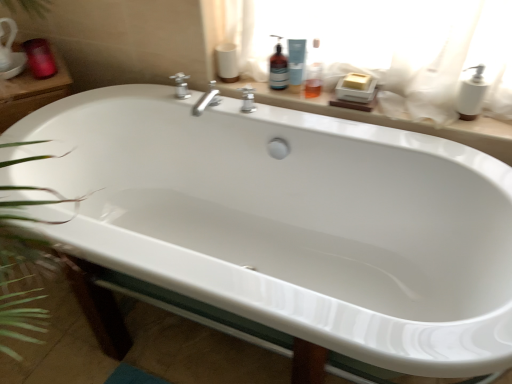
Question: Should I look upward or downward to see matte red candle at upper left?

Choices:
 (A) down
 (B) up

Answer: (B)

Question: Considering the relative sizes of matte beige soap dish at upper center and translucent plastic bottle at upper center, placed as the 2th cleaning product when sorted from right to left, in the image provided, is matte beige soap dish at upper center smaller than translucent plastic bottle at upper center, placed as the 2th cleaning product when sorted from right to left,?

Choices:
 (A) no
 (B) yes

Answer: (A)

Question: Considering the relative sizes of matte beige soap dish at upper center and translucent plastic bottle at upper center, acting as the 1th cleaning product starting from the left, in the image provided, is matte beige soap dish at upper center bigger than translucent plastic bottle at upper center, acting as the 1th cleaning product starting from the left,?

Choices:
 (A) no
 (B) yes

Answer: (B)

Question: Is the depth of matte beige soap dish at upper center less than that of translucent plastic bottle at upper center, acting as the 1th cleaning product starting from the left?

Choices:
 (A) yes
 (B) no

Answer: (A)

Question: Is matte beige soap dish at upper center turned away from translucent plastic bottle at upper center, acting as the 1th cleaning product starting from the left?

Choices:
 (A) yes
 (B) no

Answer: (B)

Question: Is matte beige soap dish at upper center positioned behind translucent plastic bottle at upper center, placed as the 2th cleaning product when sorted from right to left?

Choices:
 (A) yes
 (B) no

Answer: (B)

Question: Would you say translucent plastic bottle at upper center, placed as the 2th cleaning product when sorted from right to left, is part of matte beige soap dish at upper center's contents?

Choices:
 (A) no
 (B) yes

Answer: (A)

Question: Could you tell me if matte beige soap dish at upper center is facing matte red candle at upper left?

Choices:
 (A) yes
 (B) no

Answer: (B)

Question: Can you confirm if matte beige soap dish at upper center is positioned to the right of matte red candle at upper left?

Choices:
 (A) no
 (B) yes

Answer: (B)

Question: From a real-world perspective, is matte beige soap dish at upper center physically below matte red candle at upper left?

Choices:
 (A) yes
 (B) no

Answer: (A)

Question: Is matte beige soap dish at upper center bigger than matte red candle at upper left?

Choices:
 (A) no
 (B) yes

Answer: (B)

Question: From the image's perspective, is matte beige soap dish at upper center over matte red candle at upper left?

Choices:
 (A) no
 (B) yes

Answer: (A)

Question: Is matte beige soap dish at upper center far away from matte red candle at upper left?

Choices:
 (A) yes
 (B) no

Answer: (B)

Question: Could you tell me if white matte toilet paper at upper center is turned towards blue plastic bottle at upper center, acting as the second cleaning product starting from the left?

Choices:
 (A) no
 (B) yes

Answer: (A)